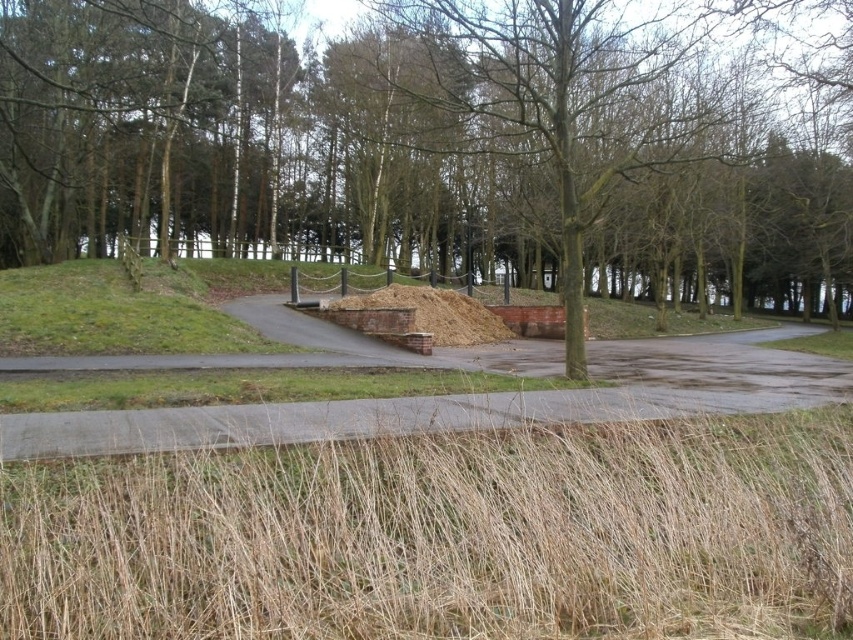
Between brown bark tree at center and dry grass at lower center, which one has more height?

Standing taller between the two is brown bark tree at center.

In the scene shown: Measure the distance between point (608, 81) and camera.

The distance of point (608, 81) from camera is 15.00 meters.

You are a GUI agent. You are given a task and a screenshot of the screen. Output one action in this format:
    pyautogui.click(x=<x>, y=<y>)
    Task: Click on the brown bark tree at center
    
    Given the screenshot: What is the action you would take?
    pyautogui.click(x=413, y=147)

Is dry grass at lower center smaller than brown woodpile at center?

Indeed, dry grass at lower center has a smaller size compared to brown woodpile at center.

Between dry grass at lower center and brown woodpile at center, which one is positioned higher?

brown woodpile at center is higher up.

Is point (753, 515) less distant than point (349, 296)?

Yes.

Where is `dry grass at lower center`? dry grass at lower center is located at coordinates (445, 536).

Locate an element on the screen. The height and width of the screenshot is (640, 853). brown bark tree at center is located at coordinates click(413, 147).

Between brown bark tree at center and brown woodpile at center, which one appears on the right side from the viewer's perspective?

From the viewer's perspective, brown bark tree at center appears more on the right side.

This screenshot has width=853, height=640. In order to click on brown bark tree at center in this screenshot , I will do `click(413, 147)`.